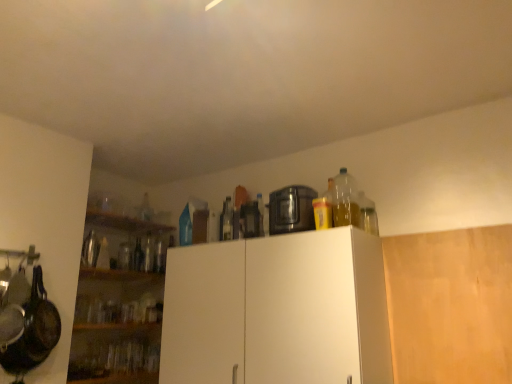
Question: Is translucent plastic bottle at upper right, the 1th bottle from the right, positioned behind brushed metal thermos at left, the 1th appliance viewed from the left?

Choices:
 (A) yes
 (B) no

Answer: (B)

Question: From the image's perspective, is translucent plastic bottle at upper right, positioned as the first bottle in front-to-back order, under brushed metal thermos at left, which is the 3th appliance from right to left?

Choices:
 (A) yes
 (B) no

Answer: (B)

Question: From a real-world perspective, is translucent plastic bottle at upper right, the 1th bottle from the right, below brushed metal thermos at left, the 1th appliance viewed from the left?

Choices:
 (A) no
 (B) yes

Answer: (A)

Question: Considering the relative positions of translucent plastic bottle at upper right, the 1th bottle from the right, and brushed metal thermos at left, which is the 3th appliance from right to left, in the image provided, is translucent plastic bottle at upper right, the 1th bottle from the right, to the right of brushed metal thermos at left, which is the 3th appliance from right to left, from the viewer's perspective?

Choices:
 (A) no
 (B) yes

Answer: (B)

Question: Can you confirm if translucent plastic bottle at upper right, the fourth bottle in the back-to-front sequence, is wider than brushed metal thermos at left, which is the 3th appliance from right to left?

Choices:
 (A) yes
 (B) no

Answer: (B)

Question: Choose the correct answer: Is black matte frying pan at left inside translucent plastic bottle at upper right, which is the fourth bottle in left-to-right order, or outside it?

Choices:
 (A) outside
 (B) inside

Answer: (A)

Question: Considering the positions of black matte frying pan at left and translucent plastic bottle at upper right, positioned as the first bottle in front-to-back order, in the image, is black matte frying pan at left wider or thinner than translucent plastic bottle at upper right, positioned as the first bottle in front-to-back order,?

Choices:
 (A) thin
 (B) wide

Answer: (B)

Question: Relative to translucent plastic bottle at upper right, the fourth bottle in the back-to-front sequence, is black matte frying pan at left in front or behind?

Choices:
 (A) behind
 (B) front

Answer: (B)

Question: Considering the positions of black matte frying pan at left and translucent plastic bottle at upper right, the 1th bottle from the right, in the image, is black matte frying pan at left bigger or smaller than translucent plastic bottle at upper right, the 1th bottle from the right,?

Choices:
 (A) big
 (B) small

Answer: (A)

Question: Considering the positions of point (160, 228) and point (95, 258), is point (160, 228) closer or farther from the camera than point (95, 258)?

Choices:
 (A) closer
 (B) farther

Answer: (B)

Question: Is wooden shelves at upper center taller or shorter than brushed metal thermos at left, which is the 3th appliance from right to left?

Choices:
 (A) short
 (B) tall

Answer: (A)

Question: From the image's perspective, is wooden shelves at upper center located above or below brushed metal thermos at left, the 1th appliance viewed from the left?

Choices:
 (A) below
 (B) above

Answer: (B)

Question: Is wooden shelves at upper center bigger or smaller than brushed metal thermos at left, the 1th appliance viewed from the left?

Choices:
 (A) small
 (B) big

Answer: (B)

Question: Is clear glass bottle at center, which is the third bottle from front to back, in front of or behind clear glass bottle at center, acting as the third bottle starting from the back, in the image?

Choices:
 (A) front
 (B) behind

Answer: (B)

Question: Is clear glass bottle at center, the 2th bottle viewed from the left, wider or thinner than clear glass bottle at center, acting as the third bottle starting from the back?

Choices:
 (A) wide
 (B) thin

Answer: (A)